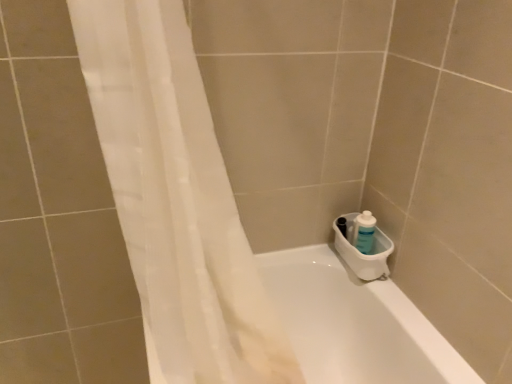
Question: From a real-world perspective, is white sheer curtain at left physically located above or below white plastic sink at lower right?

Choices:
 (A) below
 (B) above

Answer: (B)

Question: Is white sheer curtain at left to the left or to the right of white plastic sink at lower right in the image?

Choices:
 (A) left
 (B) right

Answer: (A)

Question: Which object is positioned closest to the white sheer curtain at left?

Choices:
 (A) white plastic sink at lower right
 (B) blue plastic bottle at right
 (C) white glossy bathtub at lower right

Answer: (C)

Question: Which object is the farthest from the white sheer curtain at left?

Choices:
 (A) white glossy bathtub at lower right
 (B) blue plastic bottle at right
 (C) white plastic sink at lower right

Answer: (B)